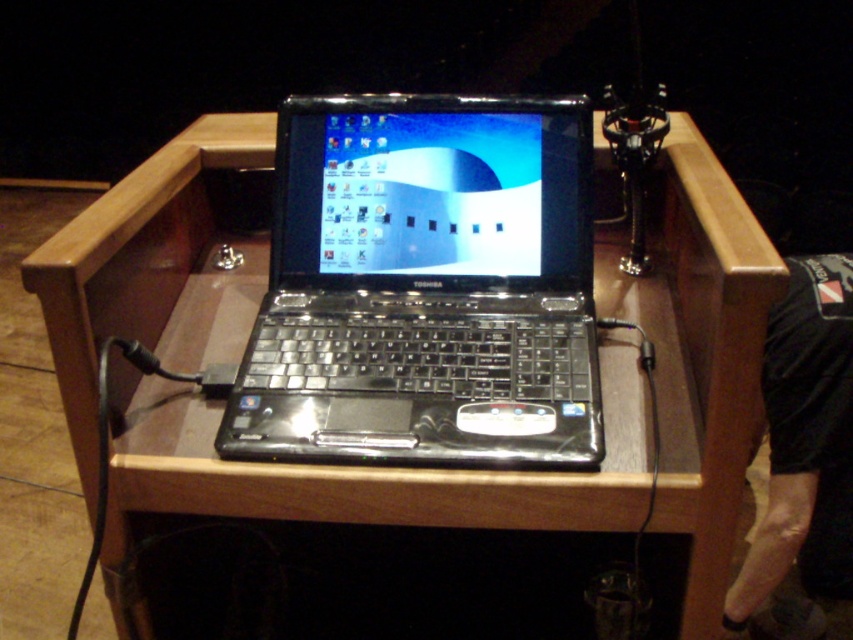
Question: Does black glossy laptop at center appear on the right side of black fabric at lower right?

Choices:
 (A) yes
 (B) no

Answer: (B)

Question: Can you confirm if black glossy laptop at center is positioned above black fabric at lower right?

Choices:
 (A) no
 (B) yes

Answer: (B)

Question: Which point appears closest to the camera in this image?

Choices:
 (A) (363, 132)
 (B) (790, 561)

Answer: (A)

Question: Considering the relative positions of black glossy laptop at center and black fabric at lower right in the image provided, where is black glossy laptop at center located with respect to black fabric at lower right?

Choices:
 (A) above
 (B) below

Answer: (A)